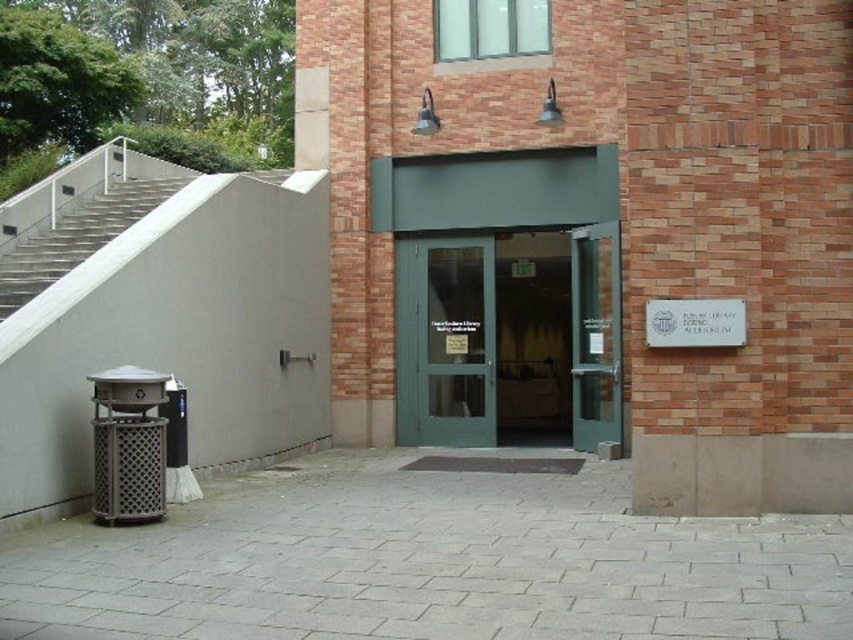
Can you confirm if green glass door at center is positioned to the right of green matte door at center?

No, green glass door at center is not to the right of green matte door at center.

Who is shorter, green glass door at center or green matte door at center?

green glass door at center is shorter.

Identify the location of green glass door at center. (508, 337).

At what (x,y) coordinates should I click in order to perform the action: click on green glass door at center. Please return your answer as a coordinate pair (x, y). Looking at the image, I should click on (508, 337).

Which is more to the left, green matte door at center or gray concrete stairs at left?

Positioned to the left is gray concrete stairs at left.

Can you confirm if green matte door at center is positioned to the left of gray concrete stairs at left?

Incorrect, green matte door at center is not on the left side of gray concrete stairs at left.

Is point (432, 371) positioned in front of point (15, 268)?

No, it is behind (15, 268).

Locate an element on the screen. The height and width of the screenshot is (640, 853). green matte door at center is located at coordinates (x=444, y=340).

Between green glass door at center and gray concrete stairs at left, which one appears on the right side from the viewer's perspective?

green glass door at center

Between green glass door at center and gray concrete stairs at left, which one is positioned higher?

gray concrete stairs at left is above.

Find the location of a particular element. This screenshot has width=853, height=640. green glass door at center is located at coordinates (508, 337).

The image size is (853, 640). Identify the location of green glass door at center. (508, 337).